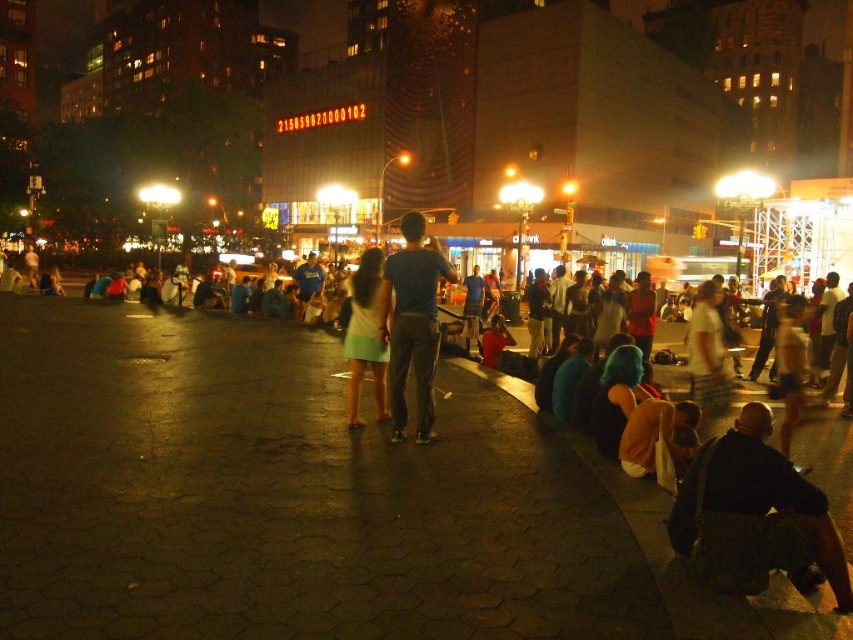
You are a photographer positioned at the center of the square. You want to capture both the dark blue jeans at center and the light green fabric dress at center in a single frame. Which direction should you adjust your camera to ensure both are visible?

Since the dark blue jeans at center is to the right of the light green fabric dress at center, you should adjust your camera slightly to the right to include both objects in the frame.

You are a photographer standing at the edge of the square, wanting to capture both the dark blue jeans at center and the light green fabric dress at center in a single frame. Given that your camera has a focal length of 50mm and a sensor size that allows for a maximum subject distance difference of 6 feet, can you include both subjects in your shot without needing to adjust your position?

The dark blue jeans at center is 6.87 feet from the light green fabric dress at center. Since the maximum subject distance difference your camera can handle is 6 feet, the difference of 6.87 feet exceeds this limit. Therefore, you cannot capture both subjects in a single frame without moving closer or adjusting your position.